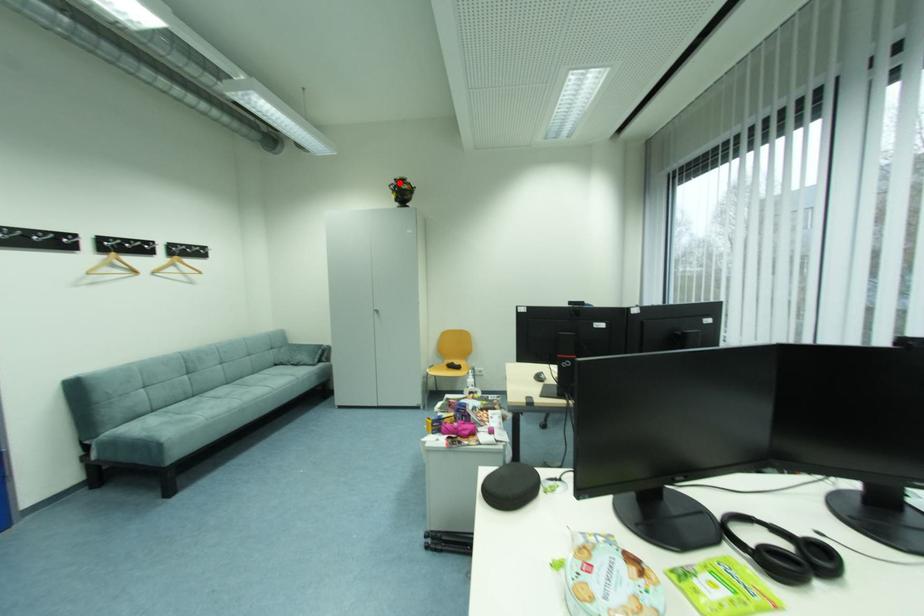
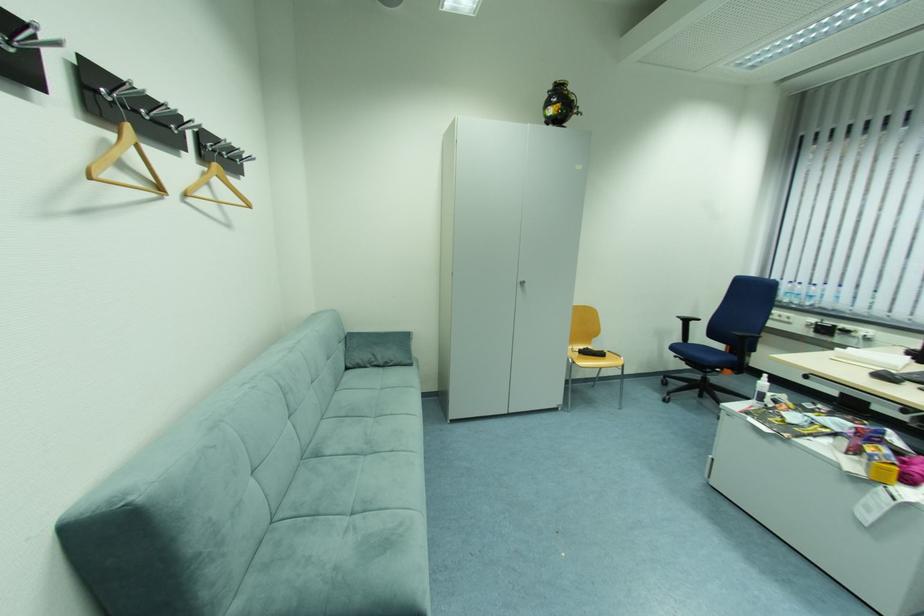
In the second image, find the point that corresponds to the highlighted location in the first image.

(558, 87)